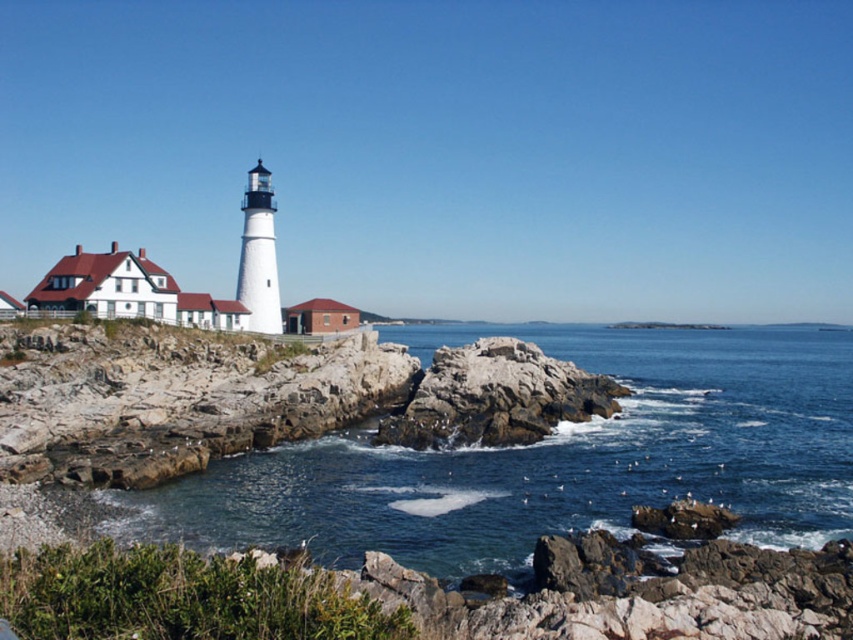
You are standing on the rocky outcrop where the lighthouse is located and want to get to the clear blue water at center. Which direction should you move to reach it?

You should move towards the center direction to reach the clear blue water at center since it is located at point (x=553, y=458).

You are standing at the viewpoint overlooking the coast. You see the clear blue water at center and the rocky outcrop at center. Which one is closer to you?

The clear blue water at center is closer to you because it is in front of the rocky outcrop at center.

Based on the photo, you are a photographer planning to capture the lighthouse and its surroundings. You want to ensure that the clear blue water at center and the rocky outcrop at center are both visible in your shot. Based on their positions, which one will appear taller in the photograph?

The clear blue water at center appears taller in the photograph because it has a greater height compared to the rocky outcrop at center.